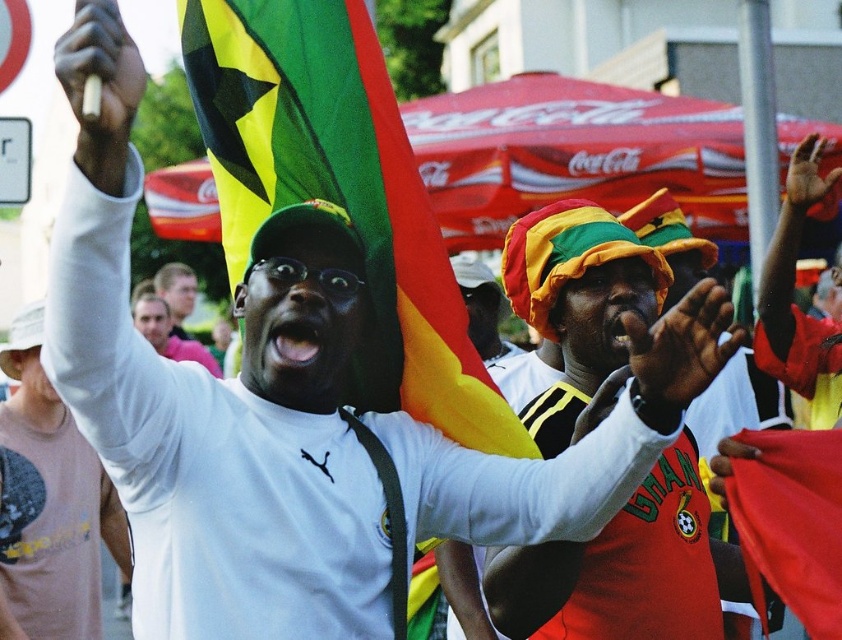
Question: Considering the relative positions of white matte shirt at upper center and red fabric flag at upper center in the image provided, where is white matte shirt at upper center located with respect to red fabric flag at upper center?

Choices:
 (A) right
 (B) left

Answer: (B)

Question: Which of these objects is positioned farthest from the white matte shirt at upper center?

Choices:
 (A) red fabric flag at upper center
 (B) polyester flag at upper center

Answer: (A)

Question: Is white matte shirt at upper center further to the viewer compared to red fabric flag at upper center?

Choices:
 (A) yes
 (B) no

Answer: (A)

Question: Estimate the real-world distances between objects in this image. Which object is farther from the white matte shirt at upper center?

Choices:
 (A) polyester flag at upper center
 (B) red fabric flag at upper center

Answer: (B)

Question: Which point is farther to the camera?

Choices:
 (A) white matte shirt at upper center
 (B) red fabric flag at upper center
 (C) polyester flag at upper center

Answer: (A)

Question: Is polyester flag at upper center closer to the viewer compared to white matte shirt at upper center?

Choices:
 (A) yes
 (B) no

Answer: (A)